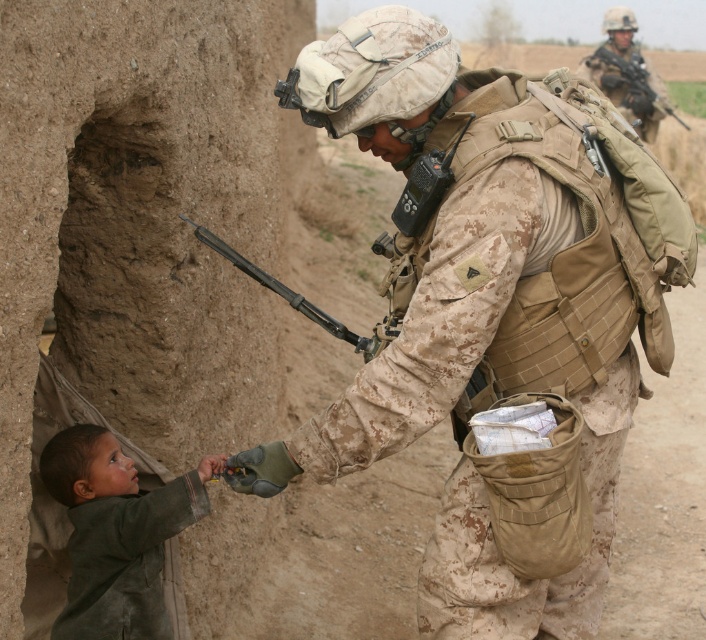
You are a photographer trying to capture a photo of the camouflage uniform at upper right without including the dark green fabric at lower left in the frame. Based on their positions, can you position yourself in a way to achieve this?

The dark green fabric at lower left is to the left of the camouflage uniform at upper right. To avoid including the dark green fabric at lower left in the photo, position yourself to the right side of the camouflage uniform at upper right so that the dark green fabric at lower left is out of the frame.

You are a drone operator observing the desert scene. You need to determine which object is nearer to you between the dark green fabric at lower left and the camouflage uniform at upper right. Which one is closer?

The dark green fabric at lower left is closer to the viewer than the camouflage uniform at upper right.

You are a drone operator monitoring the desert scene. There are two soldiers in camouflage uniform at center and camouflage uniform at upper right. Which soldier should you prioritize for closer observation based on their height?

The camouflage uniform at upper right is taller than the camouflage uniform at center, so you should prioritize observing the camouflage uniform at upper right.